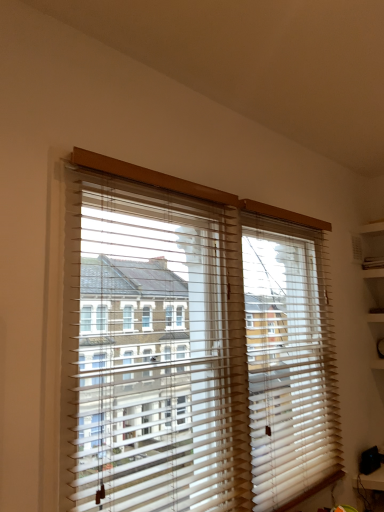
Question: Should I look upward or downward to see white plastic blinds at center?

Choices:
 (A) down
 (B) up

Answer: (A)